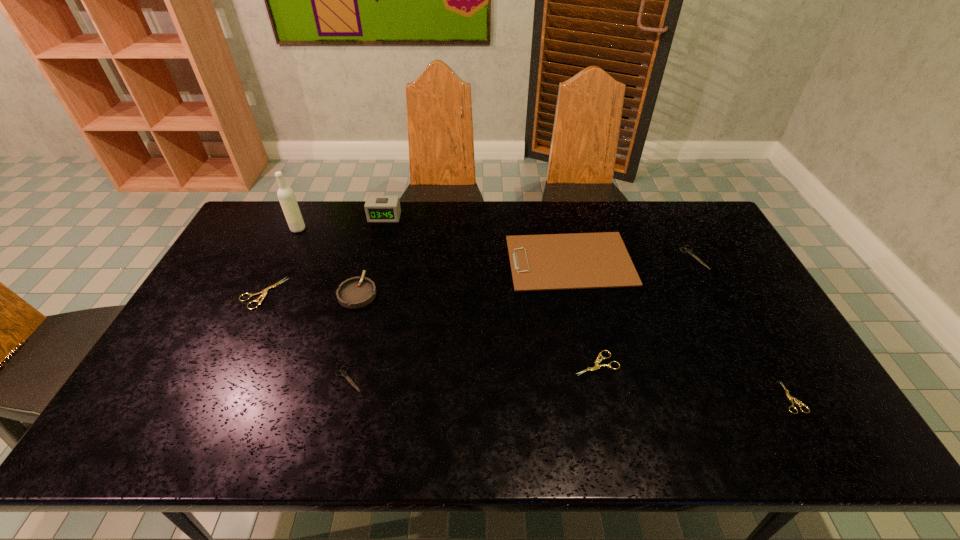
Locate an element on the screen. The height and width of the screenshot is (540, 960). white vodka is located at coordinates [286, 196].

Locate an element on the screen. This screenshot has width=960, height=540. the tallest object is located at coordinates (286, 196).

Where is `the eighth shortest object`? The image size is (960, 540). the eighth shortest object is located at coordinates (377, 208).

Locate an element on the screen. the farthest object is located at coordinates (377, 208).

This screenshot has width=960, height=540. I want to click on the third tallest object, so click(356, 292).

At what (x,y) coordinates should I click in order to perform the action: click on ashtray. Please return your answer as a coordinate pair (x, y). The height and width of the screenshot is (540, 960). Looking at the image, I should click on (356, 292).

I want to click on the fourth tallest object, so click(x=580, y=260).

Locate an element on the screen. The width and height of the screenshot is (960, 540). clipboard is located at coordinates (580, 260).

Identify the location of the eighth object from left to right. (687, 250).

Image resolution: width=960 pixels, height=540 pixels. What are the coordinates of `the right black shears` in the screenshot? It's located at (687, 250).